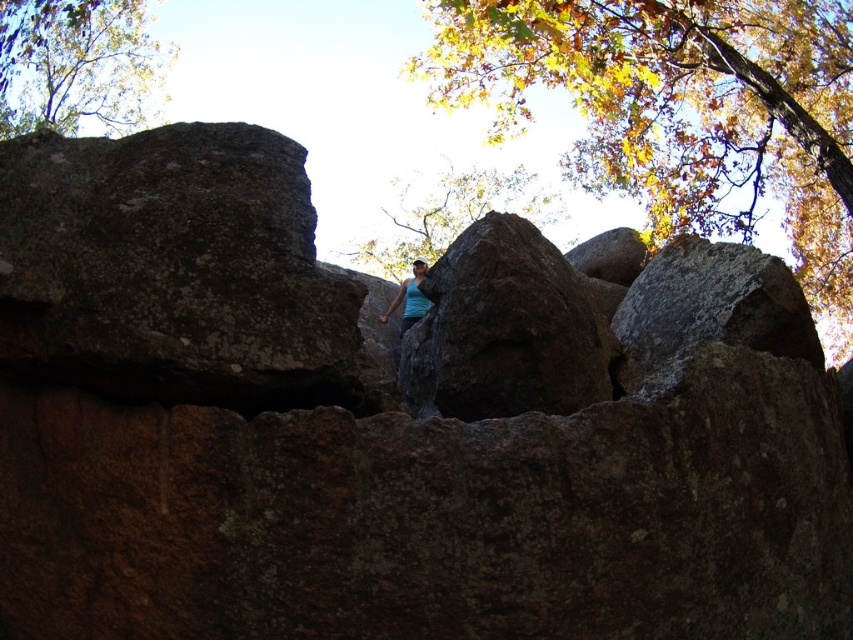
Is brown rough rock at center to the left of blue fabric tank top at center from the viewer's perspective?

No, brown rough rock at center is not to the left of blue fabric tank top at center.

Between brown rough rock at center and blue fabric tank top at center, which one appears on the left side from the viewer's perspective?

From the viewer's perspective, blue fabric tank top at center appears more on the left side.

Who is more distant from viewer, (399, 362) or (412, 266)?

The point (412, 266) is more distant.

The height and width of the screenshot is (640, 853). I want to click on brown rough rock at center, so click(506, 330).

Is yellow-green leaves at upper left to the right of blue fabric tank top at center from the viewer's perspective?

No, yellow-green leaves at upper left is not to the right of blue fabric tank top at center.

Is yellow-green leaves at upper left above blue fabric tank top at center?

Yes, yellow-green leaves at upper left is above blue fabric tank top at center.

Where is `yellow-green leaves at upper left`? yellow-green leaves at upper left is located at coordinates (74, 64).

Which is above, brown rough rock at center or brown textured rock at upper center?

brown textured rock at upper center is above.

Who is positioned more to the left, brown rough rock at center or brown textured rock at upper center?

From the viewer's perspective, brown rough rock at center appears more on the left side.

You are a GUI agent. You are given a task and a screenshot of the screen. Output one action in this format:
    pyautogui.click(x=<x>, y=<y>)
    Task: Click on the brown rough rock at center
    This screenshot has width=853, height=640.
    Given the screenshot: What is the action you would take?
    pyautogui.click(x=506, y=330)